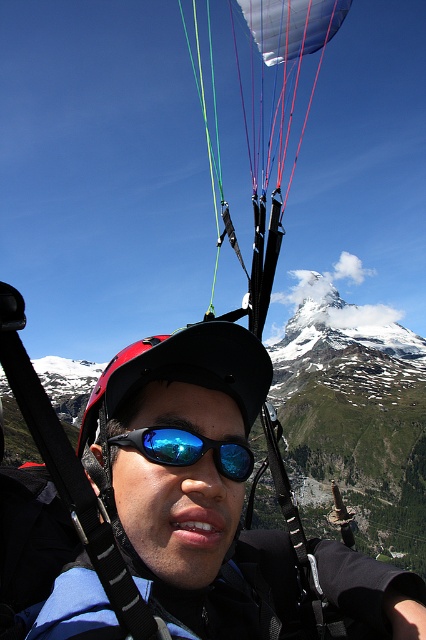
Question: Does matte black helmet at center appear on the left side of matte black parachute at center?

Choices:
 (A) no
 (B) yes

Answer: (B)

Question: Which point is farther to the camera?

Choices:
 (A) blue reflective lens goggles at center
 (B) matte black parachute at center
 (C) matte black helmet at center

Answer: (B)

Question: Among these objects, which one is farthest from the camera?

Choices:
 (A) matte black helmet at center
 (B) blue reflective lens goggles at center
 (C) matte black parachute at center

Answer: (C)

Question: Is matte black helmet at center smaller than matte black parachute at center?

Choices:
 (A) yes
 (B) no

Answer: (A)

Question: Can you confirm if matte black helmet at center is positioned to the left of blue reflective lens goggles at center?

Choices:
 (A) no
 (B) yes

Answer: (A)

Question: Which point is farther from the camera taking this photo?

Choices:
 (A) (112, 500)
 (B) (253, 186)

Answer: (B)